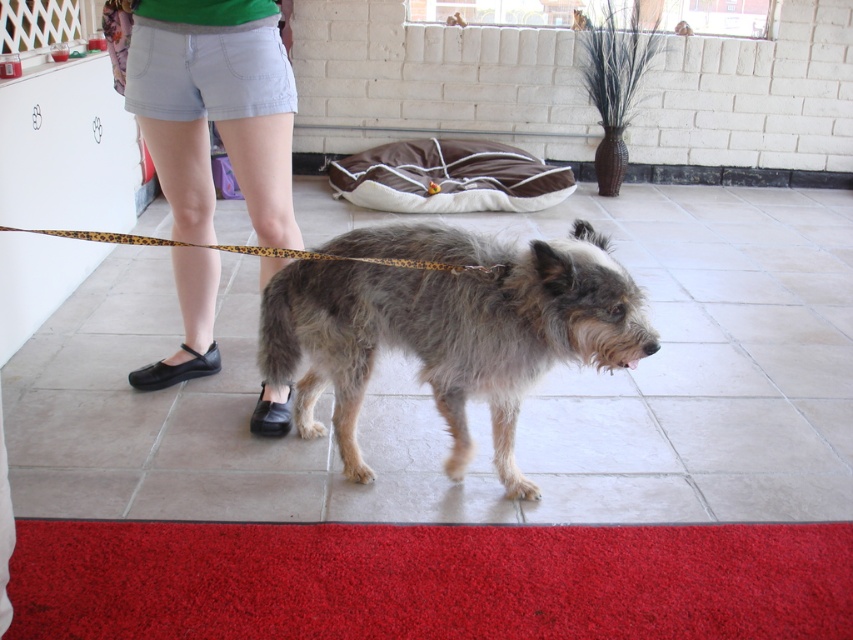
Question: Which point is farther to the camera?

Choices:
 (A) (543, 284)
 (B) (80, 234)

Answer: (A)

Question: Does fuzzy fur dog at center have a greater width compared to light blue denim shorts at center?

Choices:
 (A) yes
 (B) no

Answer: (A)

Question: Does light blue denim shorts at center have a larger size compared to leopard print leash at center?

Choices:
 (A) no
 (B) yes

Answer: (B)

Question: Does light blue denim shorts at center have a greater width compared to leopard print leash at center?

Choices:
 (A) yes
 (B) no

Answer: (B)

Question: Which of these objects is positioned closest to the light blue denim shorts at center?

Choices:
 (A) leopard print leash at center
 (B) fuzzy fur dog at center

Answer: (A)

Question: Which object is the closest to the leopard print leash at center?

Choices:
 (A) fuzzy fur dog at center
 (B) light blue denim shorts at center

Answer: (A)